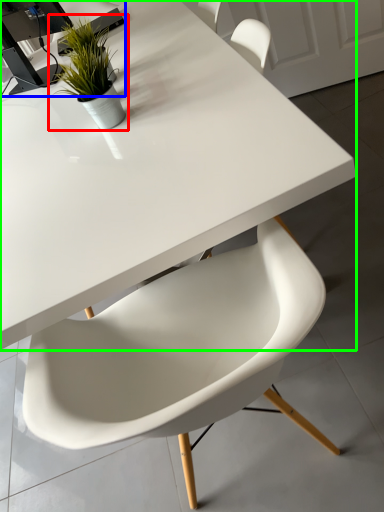
Question: Which is farther away from houseplant (highlighted by a red box)? computer desk (highlighted by a blue box) or table (highlighted by a green box)?

Choices:
 (A) computer desk
 (B) table

Answer: (A)